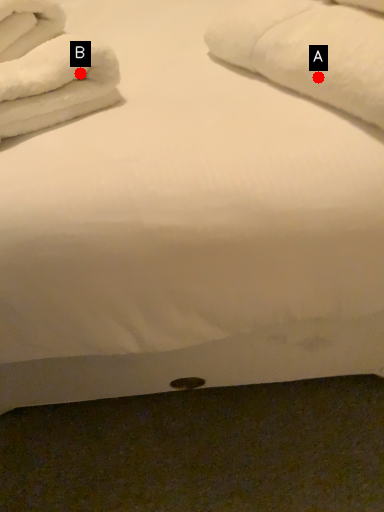
Question: Two points are circled on the image, labeled by A and B beside each circle. Among these points, which one is nearest to the camera?

Choices:
 (A) A is closer
 (B) B is closer

Answer: (A)